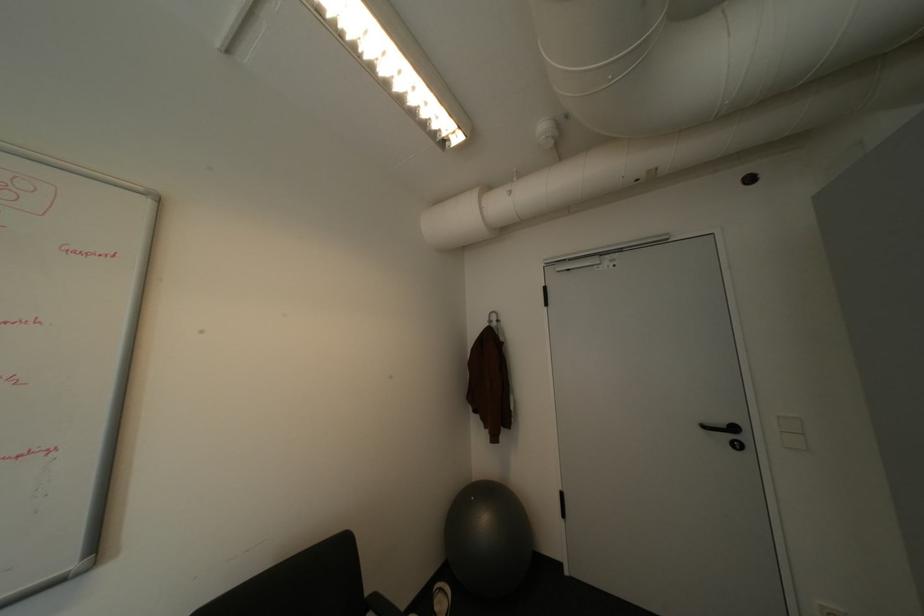
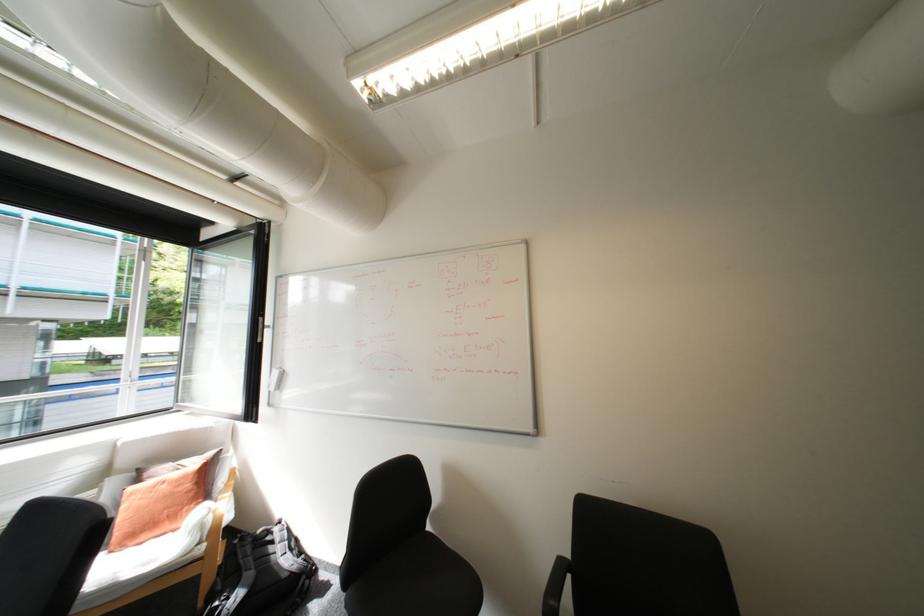
Question: The images are taken continuously from a first-person perspective. In which direction is your viewpoint rotating?

Choices:
 (A) Left
 (B) Right
 (C) Up
 (D) Down

Answer: (A)